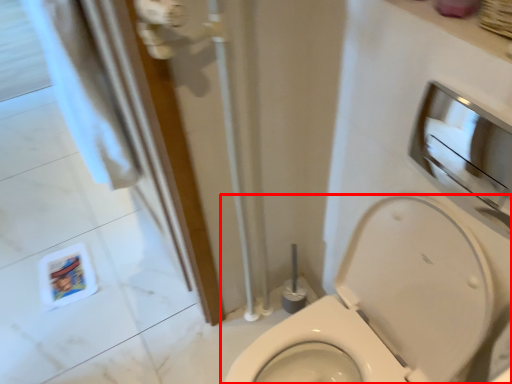
Question: In this image, where is toilet (annotated by the red box) located relative to medicine cabinet?

Choices:
 (A) right
 (B) left

Answer: (B)